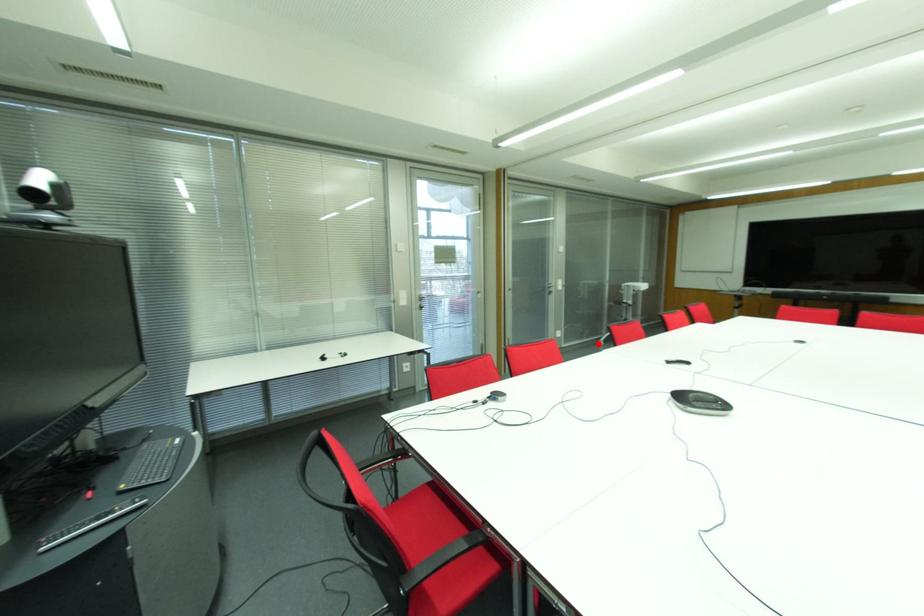
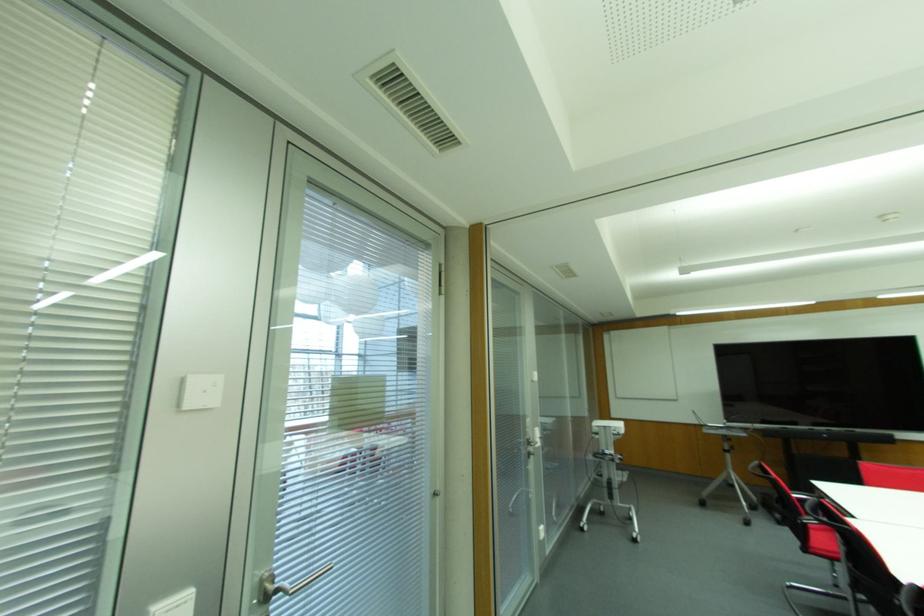
Question: I am providing you with two images of the same scene from different viewpoints. Image1 has a red point marked. In image2, the corresponding 3D location appears at what relative position? Reply with the corresponding letter.

Choices:
 (A) Closer
 (B) Farther

Answer: (A)